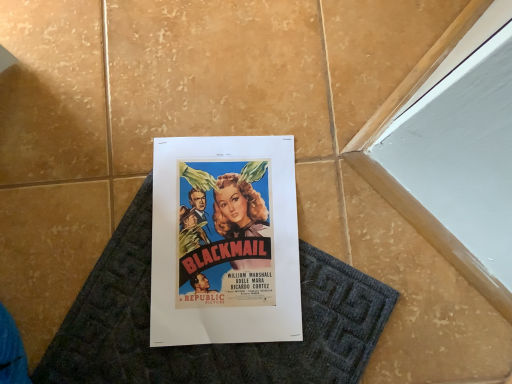
The width and height of the screenshot is (512, 384). I want to click on empty space that is ontop of dark gray textured bath mat at center (from a real-world perspective), so click(245, 285).